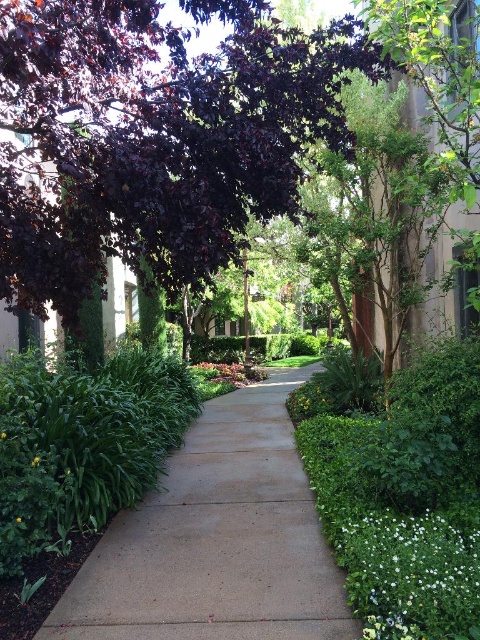
You are standing at the entrance of the garden pathway and see the purple glossy leaves at upper left and the green leafy plant at lower left. Which one appears closer to you?

The purple glossy leaves at upper left appears closer because it is in front of the green leafy plant at lower left.

You are a gardener who wants to place a decorative statue on the sandy concrete sidewalk at center. However, you notice the white matte flower at lower right. Where should you place the statue so it doesn not block the flower?

The sandy concrete sidewalk at center is positioned under the white matte flower at lower right, so placing the statue on the sidewalk away from the area directly under the flower would ensure it doesn not block the flower.

You are standing at the entrance of the garden pathway and notice two points marked on the path ahead. The first point is at coordinates point (19, 458) and the second is at point (32, 460). Which point is closer to you as you stand at the entrance?

Point (19, 458) is closer to the viewer than point (32, 460), so the first point is closer to you.